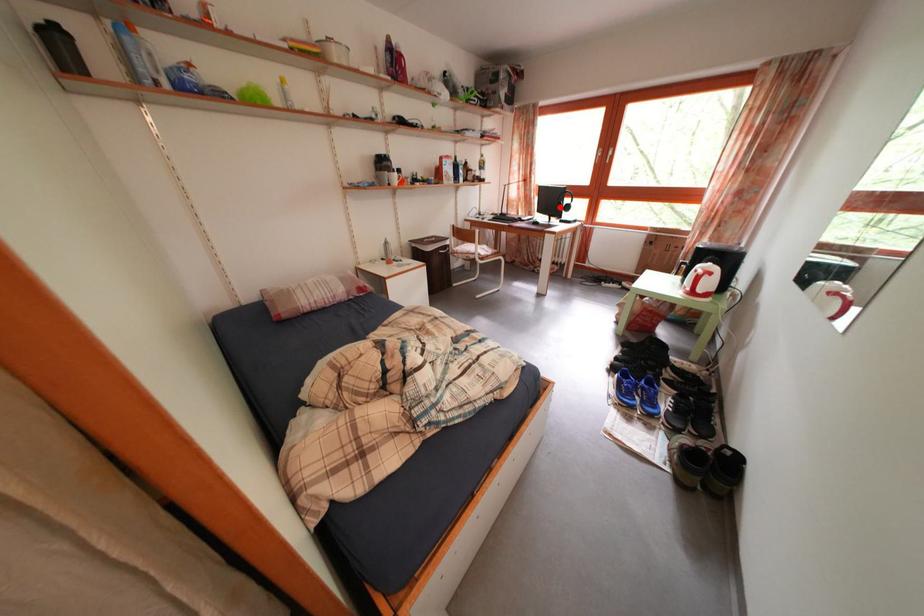
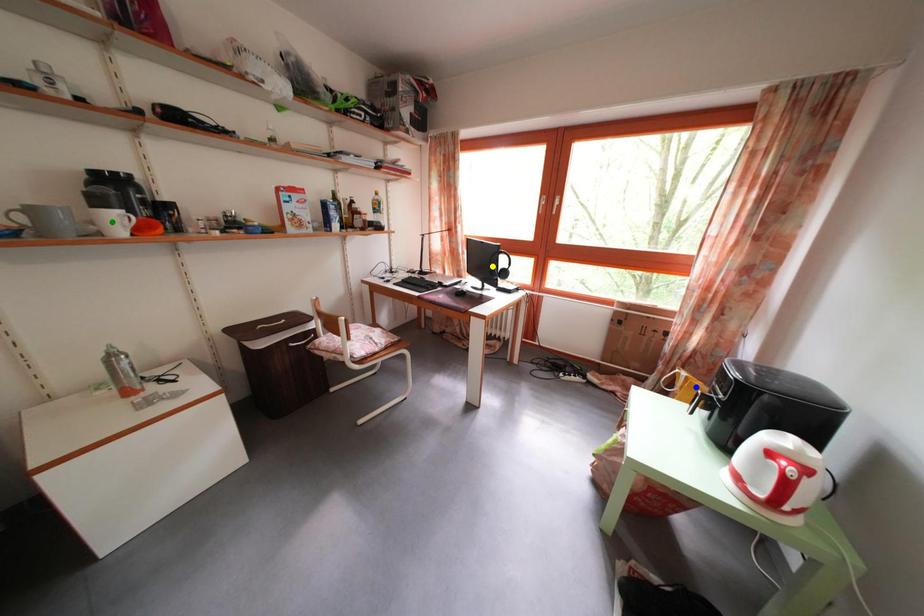
Question: I am providing you with two images of the same scene from different viewpoints. A red point is marked on the first image. You are given multiple points on the second image. Which point in image 2 represents the same 3d spot as the red point in image 1?

Choices:
 (A) blue point
 (B) green point
 (C) yellow point

Answer: (C)